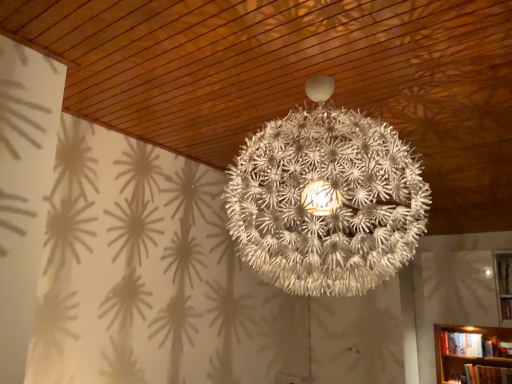
Question: Is hardcover book at lower right wider than white matte spherical lamp at center?

Choices:
 (A) yes
 (B) no

Answer: (B)

Question: From a real-world perspective, is hardcover book at lower right positioned under white matte spherical lamp at center based on gravity?

Choices:
 (A) yes
 (B) no

Answer: (A)

Question: Is hardcover book at lower right located outside white matte spherical lamp at center?

Choices:
 (A) yes
 (B) no

Answer: (A)

Question: Is white matte spherical lamp at center located within hardcover book at lower right?

Choices:
 (A) no
 (B) yes

Answer: (A)

Question: From a real-world perspective, does hardcover book at lower right stand above white matte spherical lamp at center?

Choices:
 (A) no
 (B) yes

Answer: (A)

Question: Is hardcover book at lower right smaller than white matte spherical lamp at center?

Choices:
 (A) no
 (B) yes

Answer: (B)

Question: Considering the relative sizes of white matte spherical lamp at center and hardcover book at lower right in the image provided, is white matte spherical lamp at center taller than hardcover book at lower right?

Choices:
 (A) yes
 (B) no

Answer: (A)

Question: Is white matte spherical lamp at center far from hardcover book at lower right?

Choices:
 (A) yes
 (B) no

Answer: (A)

Question: Is white matte spherical lamp at center directly adjacent to hardcover book at lower right?

Choices:
 (A) no
 (B) yes

Answer: (A)

Question: Is white matte spherical lamp at center smaller than hardcover book at lower right?

Choices:
 (A) no
 (B) yes

Answer: (A)

Question: Is white matte spherical lamp at center positioned behind hardcover book at lower right?

Choices:
 (A) yes
 (B) no

Answer: (B)

Question: Can you confirm if white matte spherical lamp at center is positioned to the left of hardcover book at lower right?

Choices:
 (A) no
 (B) yes

Answer: (B)

Question: Based on their sizes in the image, would you say white matte spherical lamp at center is bigger or smaller than hardcover book at lower right?

Choices:
 (A) big
 (B) small

Answer: (A)